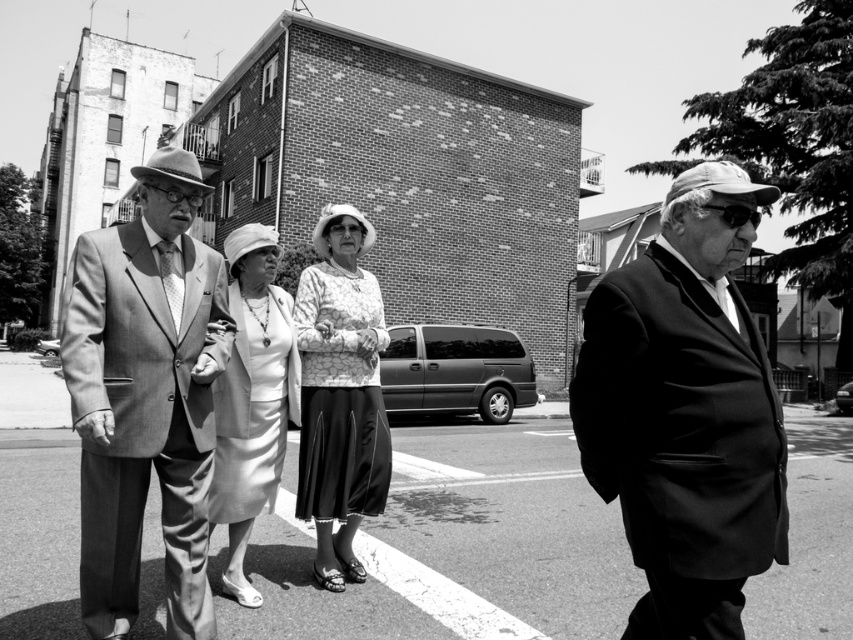
You are a photographer trying to capture a group photo of the smooth gray suit at left and the patterned fabric dress at center. Since you want to ensure both subjects are in focus, you need to know which one is larger in the frame. Can you determine which object is bigger?

The smooth gray suit at left is bigger than the patterned fabric dress at center, so the photographer should focus on the smooth gray suit at left as it occupies more space in the frame.

Consider the image. You are a photographer trying to frame a shot of the smooth gray suit at left and the patterned fabric dress at center. Based on their positions, which object should you adjust your camera angle to focus on first if you want to capture both in the same frame?

The smooth gray suit at left is wider than the patterned fabric dress at center, so you should focus on the smooth gray suit at left first to ensure it fits within the frame.